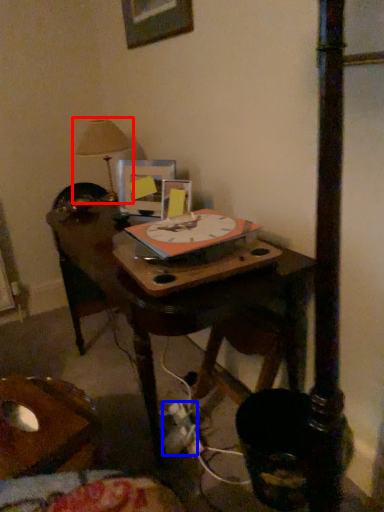
Question: Which point is further to the camera, table lamp (highlighted by a red box) or plug (highlighted by a blue box)?

Choices:
 (A) table lamp
 (B) plug

Answer: (A)